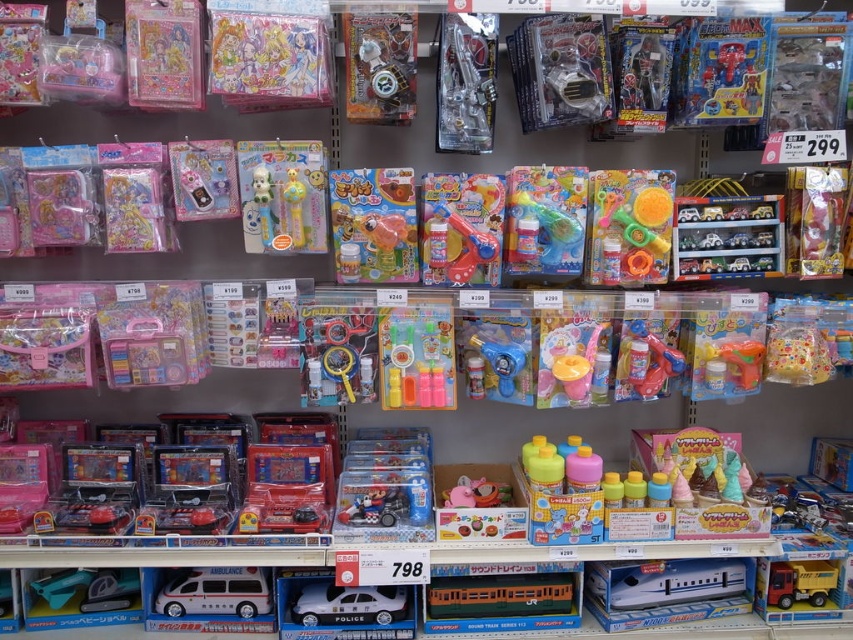
You are a delivery person standing at the camera position. You need to place a box that is 5 feet long on the floor between point A at point (447, 49) and the camera. Is there enough space?

The distance between point A at point (447, 49) and the camera is 5.25 feet, so yes, the box can be placed there as it is slightly longer than the box.

You are a customer in the store and want to reach both the point at coordinates point (679, 356) and the point at coordinates point (813, 593). Which point will you reach first?

You will reach point (679, 356) first because it is closer to you than point (813, 593).

You are a customer in the store and want to reach both the point at coordinates (223, 612) and the point at (263, 193). Which point should you approach first to reach the one closer to you?

You should approach point (223, 612) first because it is closer to you than point (263, 193), which is further away.